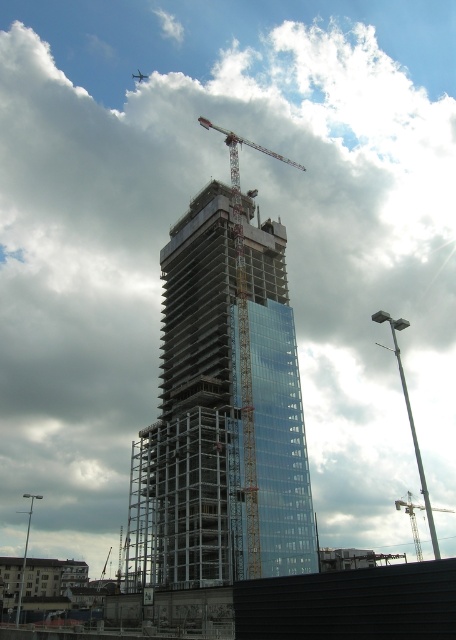
You are an architect reviewing the construction site of the transparent glass tower at center and the metallic silver crane at center. Which object would cast a longer shadow during midday when the sun is directly overhead?

The transparent glass tower at center is larger in size than the metallic silver crane at center, so it would cast a longer shadow during midday when the sun is directly overhead.

You are an engineer standing at the base of the building. You need to locate the metallic construction crane at center. Where is it positioned in the image?

The metallic construction crane at center is positioned at the coordinates point (244, 348) in the image.

You are an engineer inspecting the construction site of a skyscraper. You notice two cranes, the metallic construction crane at center and the metallic silver crane at center. Which one is bigger in size?

The metallic construction crane at center is larger in size compared to the metallic silver crane at center.